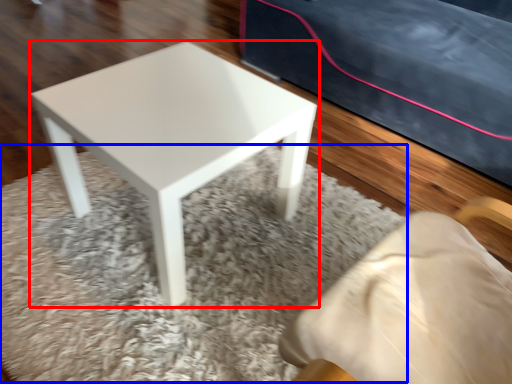
Question: Which of the following is the farthest to the observer, stool (highlighted by a red box) or mat (highlighted by a blue box)?

Choices:
 (A) stool
 (B) mat

Answer: (A)